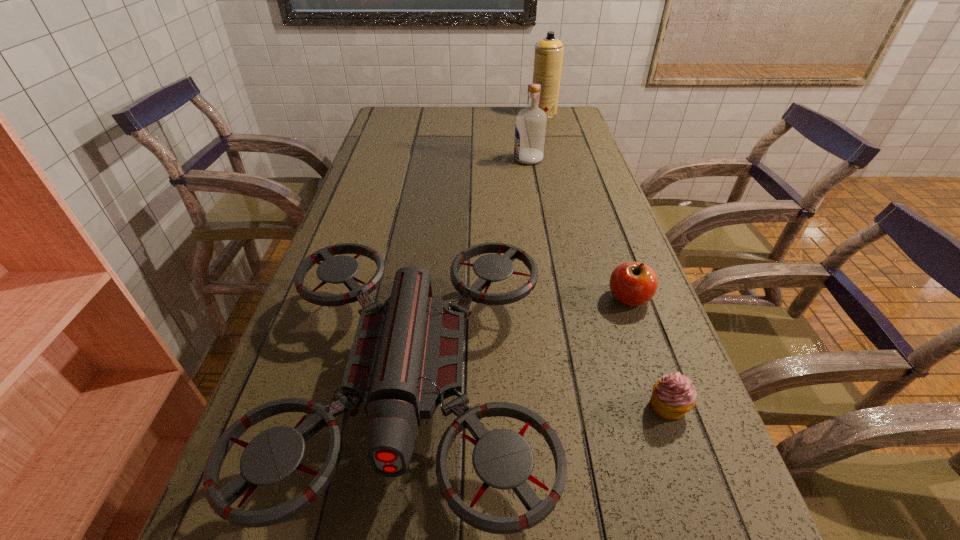
Where is `the tallest object`? The image size is (960, 540). the tallest object is located at coordinates (548, 58).

Locate an element on the screen. the farthest object is located at coordinates (548, 58).

Locate an element on the screen. the fourth nearest object is located at coordinates (530, 129).

Find the location of a particular element. the fourth shortest object is located at coordinates (530, 129).

Locate an element on the screen. The width and height of the screenshot is (960, 540). apple is located at coordinates (632, 283).

Where is `cupcake`? cupcake is located at coordinates (672, 396).

Where is `vacant space located on the front of the tallest object`? vacant space located on the front of the tallest object is located at coordinates (549, 136).

The image size is (960, 540). I want to click on vacant space located 0.340m on the label of the vodka, so click(x=411, y=159).

Locate an element on the screen. free space located 0.380m on the label of the vodka is located at coordinates (398, 159).

Locate an element on the screen. This screenshot has height=540, width=960. vacant space located on the label of the vodka is located at coordinates (429, 159).